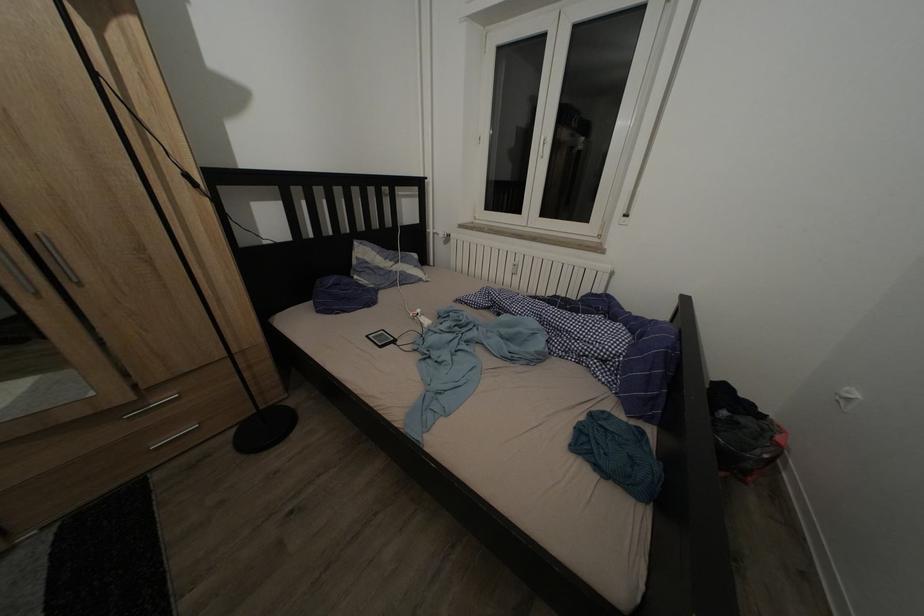
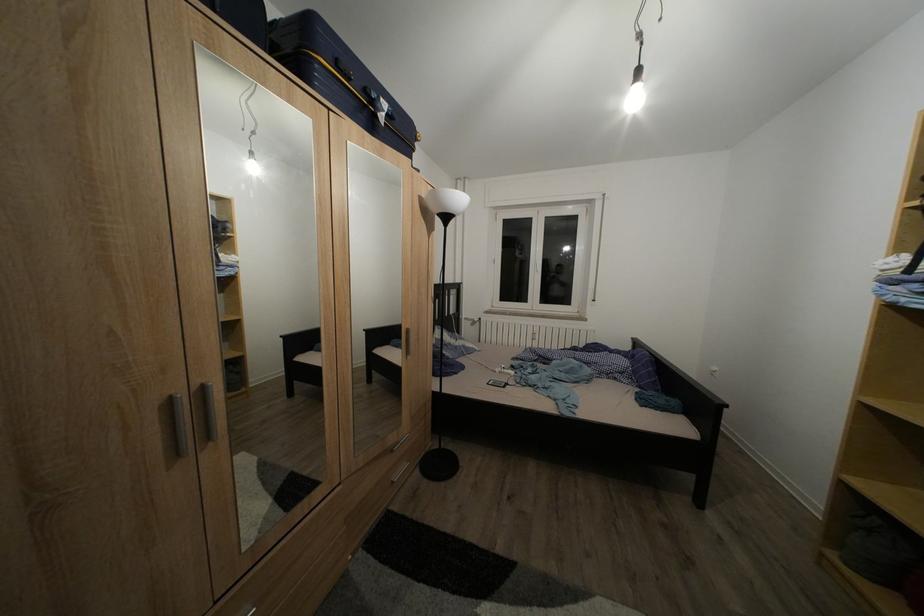
Which direction would the cameraman need to move to produce the second image?

The cameraman walked toward left, backward.